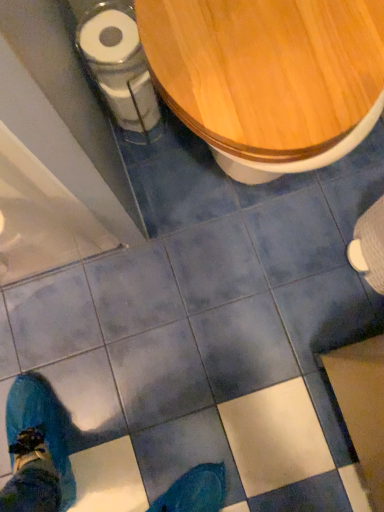
At what (x,y) coordinates should I click in order to perform the action: click on free space in front of wooden at upper right. Please return your answer as a coordinate pair (x, y). Looking at the image, I should click on (247, 316).